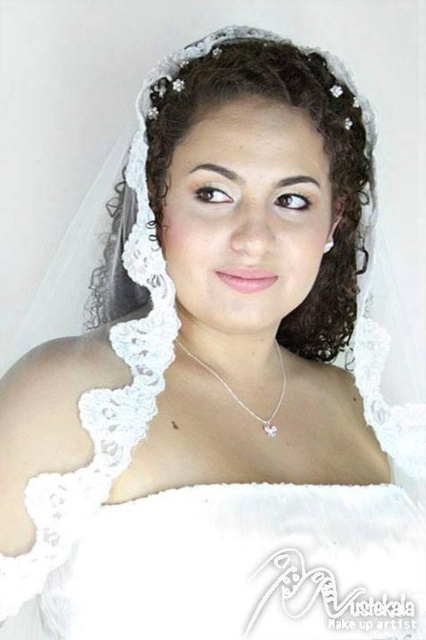
Who is positioned more to the right, curly white veil at center or silver/pearl necklace at center?

From the viewer's perspective, silver/pearl necklace at center appears more on the right side.

Is curly white veil at center in front of silver/pearl necklace at center?

Yes, it is.

I want to click on curly white veil at center, so click(x=325, y=152).

Locate an element on the screen. The height and width of the screenshot is (640, 426). curly white veil at center is located at coordinates coord(325,152).